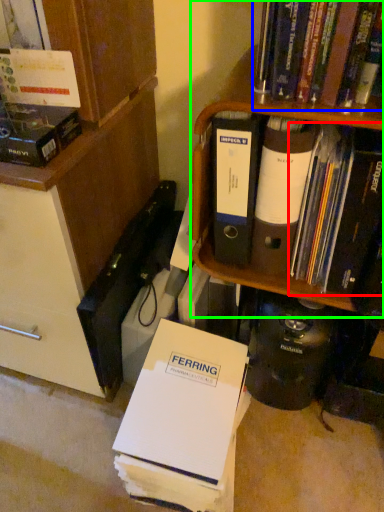
Question: Estimate the real-world distances between objects in this image. Which object is farther from book (highlighted by a red box), book (highlighted by a blue box) or shelf (highlighted by a green box)?

Choices:
 (A) book
 (B) shelf

Answer: (A)